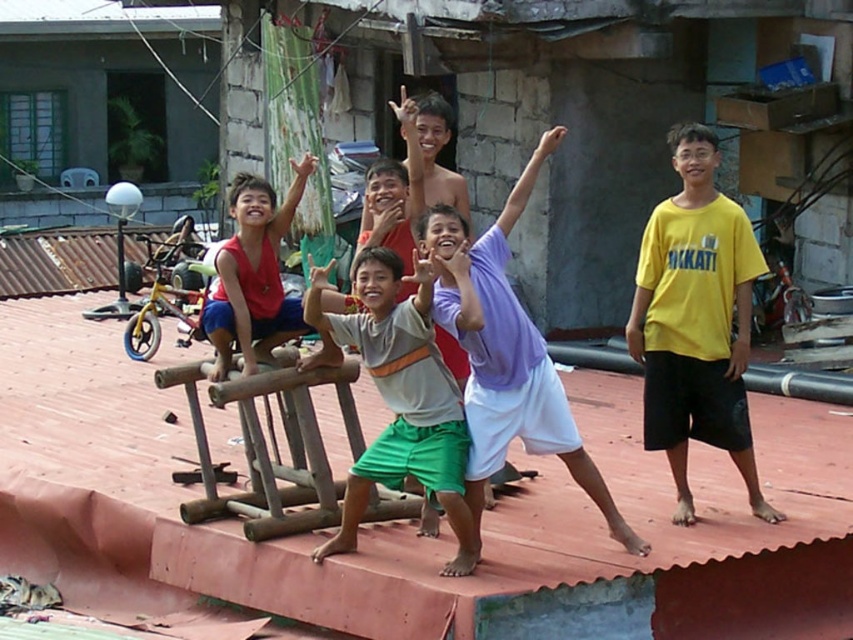
You are a photographer standing at the camera position. You want to capture a closeup shot of the yellow cotton shirt at right. Can you estimate whether you need to move closer or farther away from your current position to achieve this?

The yellow cotton shirt at right is 8.56 meters from camera. To capture a closeup shot, you need to move closer to reduce the distance between the camera and the yellow cotton shirt at right.

In the scene shown: You are standing at the camera position and want to throw a ball to the child wearing the yellow cotton shirt at right. If the ball travels in a straight line, will it pass over or under the wooden structure where the children are playing?

The yellow cotton shirt at right is 8.56 meters away from the camera. Since the wooden structure is part of the play area where the children are positioned, and the ball is traveling in a straight line towards the shirt, the ball will pass over the wooden structure.

You are standing at the point with coordinates point at [490,326] and want to move towards the point at [711,330]. Which direction should you move?

You should move forward because point at [711,330] is behind point at [490,326].